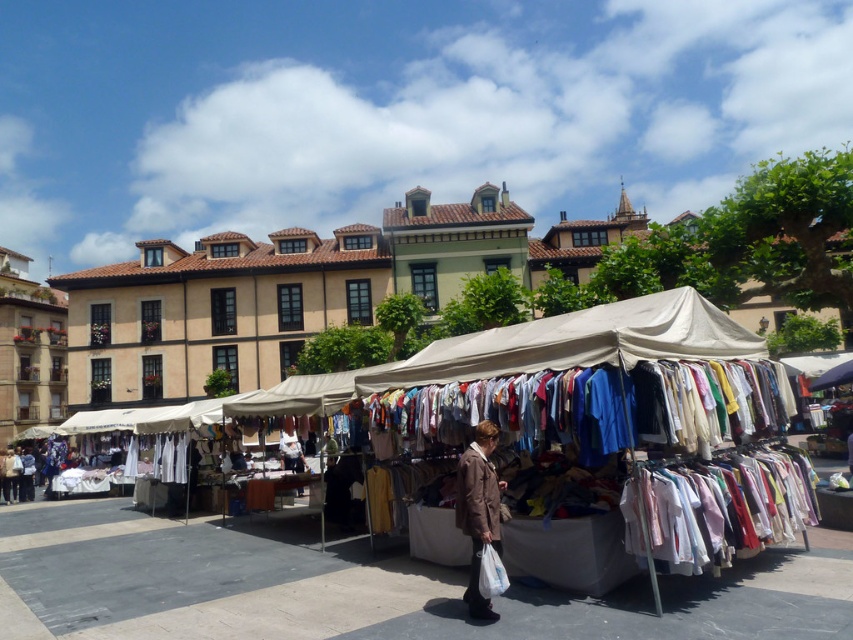
Question: Is white fabric tent at center smaller than white cotton shirt at center?

Choices:
 (A) yes
 (B) no

Answer: (B)

Question: Among these objects, which one is farthest from the camera?

Choices:
 (A) brown fabric coat at lower center
 (B) white fabric tent at center

Answer: (A)

Question: Considering the real-world distances, which object is closest to the white cotton shirt at center?

Choices:
 (A) brown fabric coat at lower center
 (B) white fabric tent at center

Answer: (B)

Question: Which object appears closest to the camera in this image?

Choices:
 (A) brown fabric coat at lower center
 (B) white cotton shirt at center

Answer: (A)

Question: Is brown fabric coat at lower center above white cotton shirt at center?

Choices:
 (A) no
 (B) yes

Answer: (B)

Question: Can you confirm if brown fabric coat at lower center is positioned to the left of white cotton shirt at center?

Choices:
 (A) yes
 (B) no

Answer: (B)